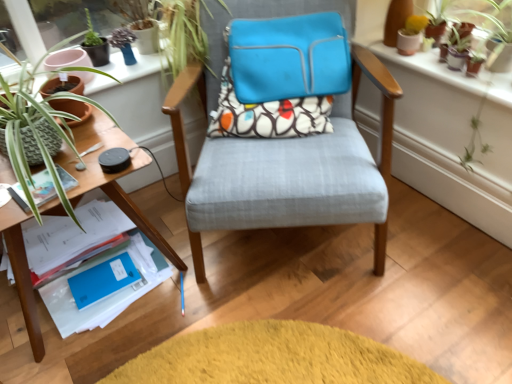
I want to click on free point in front of blue matte paper at lower left, marked as the second paperback book in a top-to-bottom arrangement, so click(96, 304).